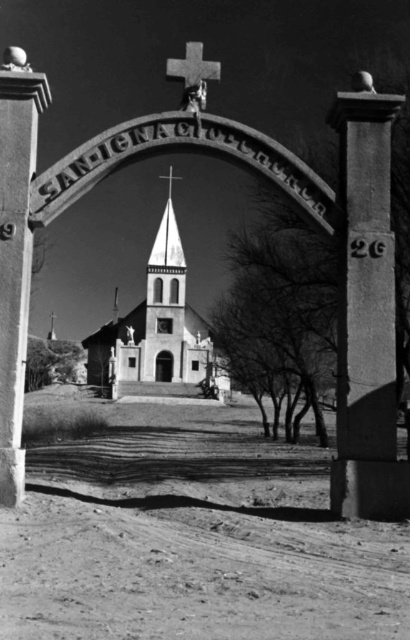
Is smooth white church at center smaller than smooth stone cross at upper center?

Indeed, smooth white church at center has a smaller size compared to smooth stone cross at upper center.

Does smooth white church at center have a lesser height compared to smooth stone cross at upper center?

Yes, smooth white church at center is shorter than smooth stone cross at upper center.

Who is more forward, (166, 273) or (198, 72)?

Point (198, 72) is in front.

The width and height of the screenshot is (410, 640). Identify the location of smooth white church at center. (159, 328).

Is smooth white church at center above metallic cross at center?

No.

Between smooth white church at center and metallic cross at center, which one appears on the right side from the viewer's perspective?

Positioned to the right is metallic cross at center.

Image resolution: width=410 pixels, height=640 pixels. What do you see at coordinates (159, 328) in the screenshot? I see `smooth white church at center` at bounding box center [159, 328].

You are a GUI agent. You are given a task and a screenshot of the screen. Output one action in this format:
    pyautogui.click(x=<x>, y=<y>)
    Task: Click on the smooth white church at center
    The image size is (410, 640).
    Given the screenshot: What is the action you would take?
    pyautogui.click(x=159, y=328)

What are the coordinates of `smooth stone cross at upper center` in the screenshot? It's located at (193, 67).

Is smooth stone cross at upper center shorter than metallic cross at center?

Incorrect, smooth stone cross at upper center's height does not fall short of metallic cross at center's.

Identify the location of smooth stone cross at upper center. (193, 67).